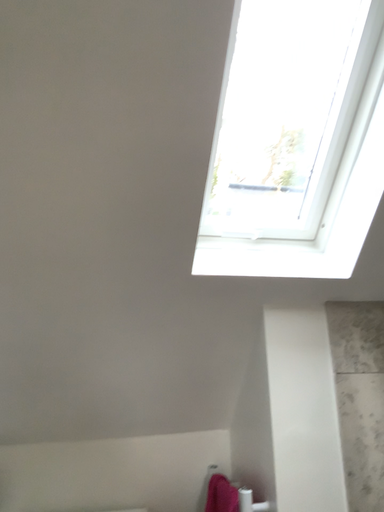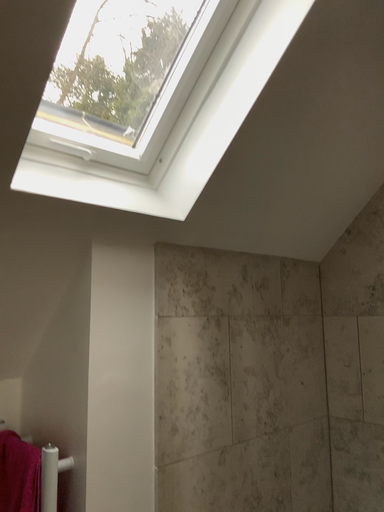
Question: Which way did the camera rotate in the video?

Choices:
 (A) rotated upward
 (B) rotated downward

Answer: (B)